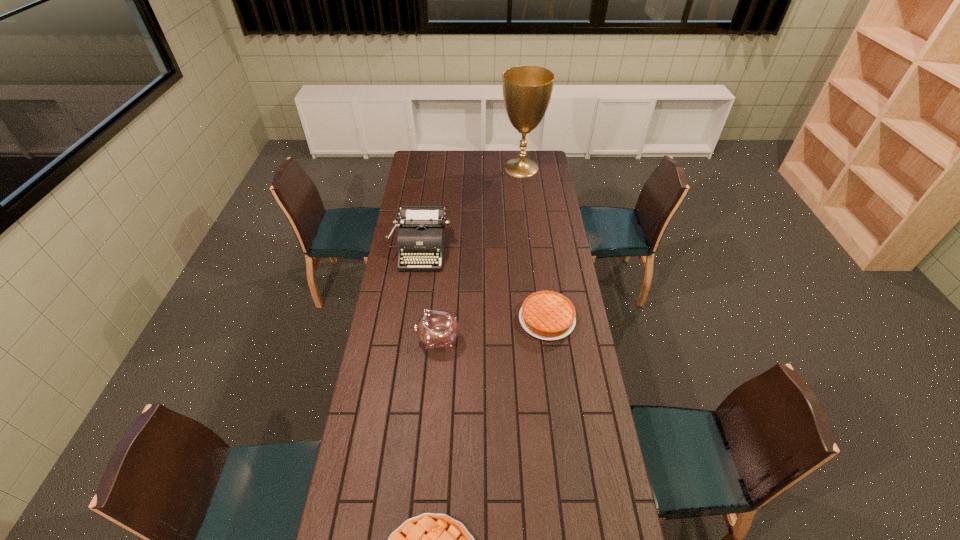
Locate an element on the screen. This screenshot has height=540, width=960. the farthest object is located at coordinates (527, 90).

This screenshot has height=540, width=960. I want to click on trophy cup, so click(527, 90).

At what (x,y) coordinates should I click in order to perform the action: click on the second farthest object. Please return your answer as a coordinate pair (x, y). Looking at the image, I should click on (421, 234).

Where is `piggy bank`? Image resolution: width=960 pixels, height=540 pixels. piggy bank is located at coordinates (436, 328).

Locate an element on the screen. the right pie is located at coordinates (548, 315).

Identify the location of vacant region located on the left of the tallest object. This screenshot has width=960, height=540. (479, 168).

This screenshot has height=540, width=960. I want to click on vacant space located on the front-facing side of the second farthest object, so click(x=414, y=302).

Where is `vacant space situated 0.120m on the front facing side of the piggy bank`? The image size is (960, 540). vacant space situated 0.120m on the front facing side of the piggy bank is located at coordinates (386, 340).

I want to click on free spot located on the front facing side of the piggy bank, so click(x=381, y=340).

Locate an element on the screen. This screenshot has height=540, width=960. free space located 0.270m on the back of the farther pie is located at coordinates (539, 255).